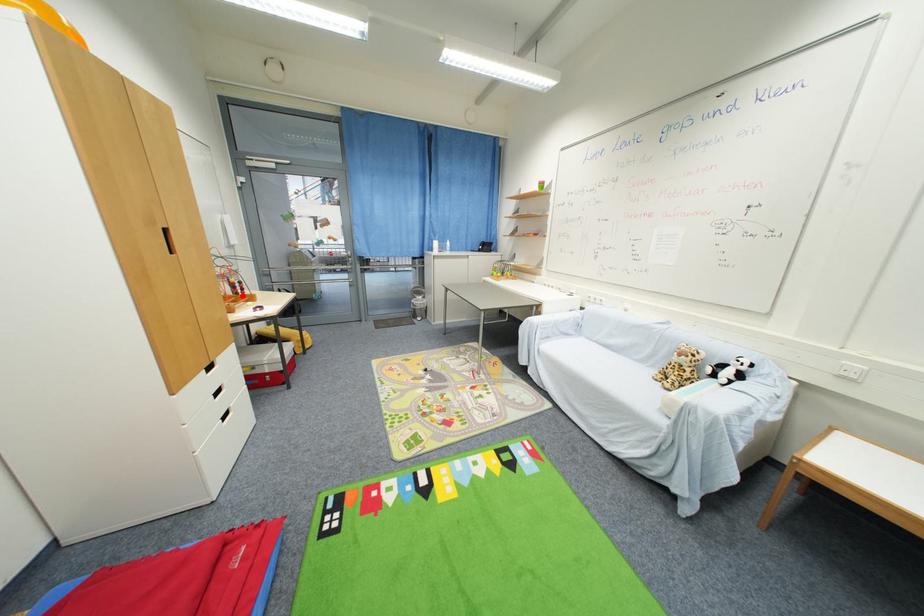
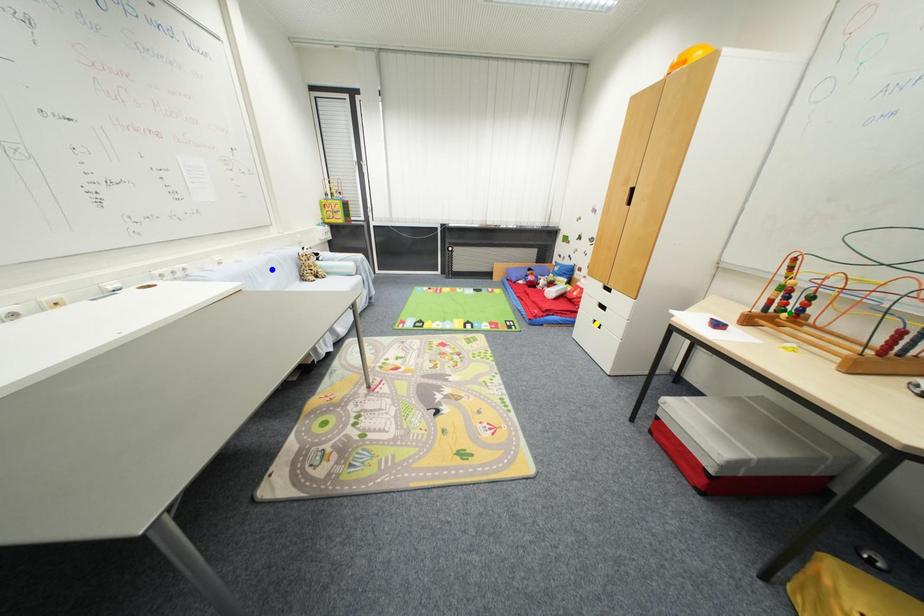
Question: I am providing you with two images of the same scene from different viewpoints. A red point is marked on the first image. You are given multiple points on the second image. Can you choose the point in image 2 that corresponds to the point in image 1?

Choices:
 (A) blue point
 (B) yellow point
 (C) green point

Answer: (C)